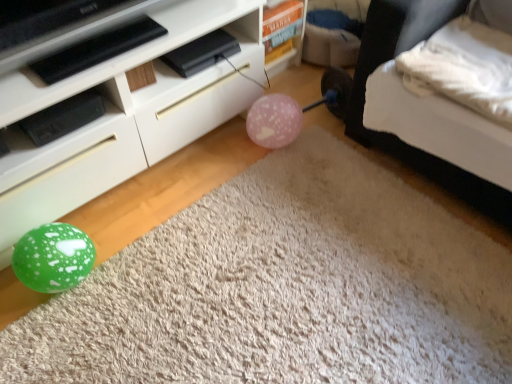
Question: From a real-world perspective, is white soft bed at lower right under pink matte balloon at center?

Choices:
 (A) no
 (B) yes

Answer: (A)

Question: Is white soft bed at lower right far away from pink matte balloon at center?

Choices:
 (A) no
 (B) yes

Answer: (A)

Question: Considering the relative sizes of white soft bed at lower right and pink matte balloon at center in the image provided, is white soft bed at lower right shorter than pink matte balloon at center?

Choices:
 (A) yes
 (B) no

Answer: (B)

Question: Is white soft bed at lower right oriented away from pink matte balloon at center?

Choices:
 (A) no
 (B) yes

Answer: (A)

Question: Is white soft bed at lower right wider than pink matte balloon at center?

Choices:
 (A) yes
 (B) no

Answer: (A)

Question: Is white soft bed at lower right bigger or smaller than pink matte balloon at center?

Choices:
 (A) small
 (B) big

Answer: (B)

Question: Looking at their shapes, would you say white soft bed at lower right is wider or thinner than pink matte balloon at center?

Choices:
 (A) thin
 (B) wide

Answer: (B)

Question: Does point (371, 132) appear closer or farther from the camera than point (290, 140)?

Choices:
 (A) closer
 (B) farther

Answer: (A)

Question: Is white soft bed at lower right in front of or behind pink matte balloon at center in the image?

Choices:
 (A) behind
 (B) front

Answer: (B)

Question: Choose the correct answer: Is white soft pillow at upper right inside pink matte balloon at center or outside it?

Choices:
 (A) outside
 (B) inside

Answer: (A)

Question: Is point (450, 31) positioned closer to the camera than point (287, 125)?

Choices:
 (A) closer
 (B) farther

Answer: (A)

Question: Considering the positions of white soft pillow at upper right and pink matte balloon at center in the image, is white soft pillow at upper right taller or shorter than pink matte balloon at center?

Choices:
 (A) tall
 (B) short

Answer: (B)

Question: From a real-world perspective, is white soft pillow at upper right physically located above or below pink matte balloon at center?

Choices:
 (A) below
 (B) above

Answer: (B)

Question: Is pink matte balloon at center in front of or behind white soft pillow at upper right in the image?

Choices:
 (A) front
 (B) behind

Answer: (B)

Question: From their relative heights in the image, would you say pink matte balloon at center is taller or shorter than white soft pillow at upper right?

Choices:
 (A) short
 (B) tall

Answer: (B)